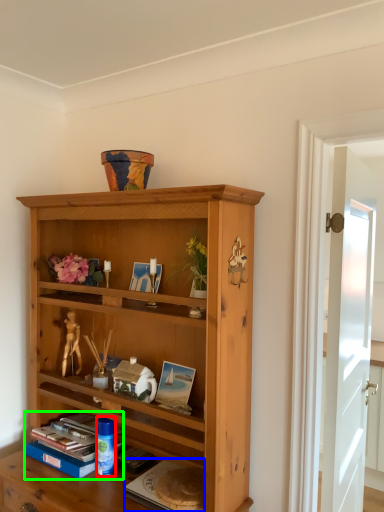
Question: Which object is the closest to the toy (highlighted by a red box)? Choose among these: paperback book (highlighted by a blue box) or book (highlighted by a green box).

Choices:
 (A) paperback book
 (B) book

Answer: (B)